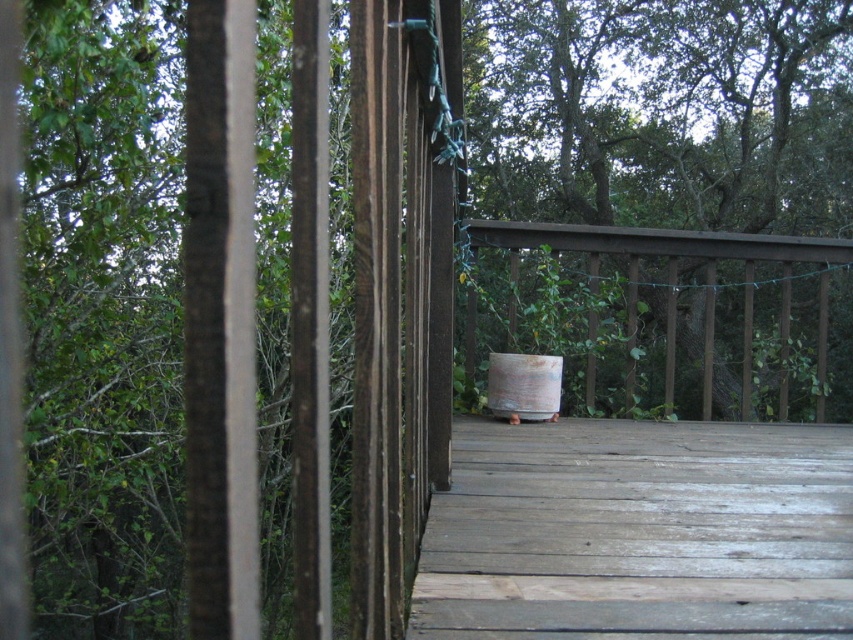
Measure the distance between weathered wood deck at center and rusty metal barrel at center.

weathered wood deck at center is 26.08 inches away from rusty metal barrel at center.

The image size is (853, 640). Identify the location of weathered wood deck at center. (639, 532).

Is white ceramic pot at center shorter than brown wooden rail at center?

No.

Who is more forward, (827,220) or (646,243)?

Positioned in front is point (646,243).

Is point (642, 209) positioned before point (846, 244)?

That is False.

The image size is (853, 640). What are the coordinates of `white ceramic pot at center` in the screenshot? It's located at (662, 113).

Between point (519, 632) and point (796, 248), which one is positioned in front?

Positioned in front is point (519, 632).

Can you confirm if weathered wood deck at center is positioned to the right of brown wooden rail at center?

In fact, weathered wood deck at center is to the left of brown wooden rail at center.

Which is behind, point (787, 529) or point (495, 234)?

The point (495, 234) is behind.

At what (x,y) coordinates should I click in order to perform the action: click on weathered wood deck at center. Please return your answer as a coordinate pair (x, y). Looking at the image, I should click on (639, 532).